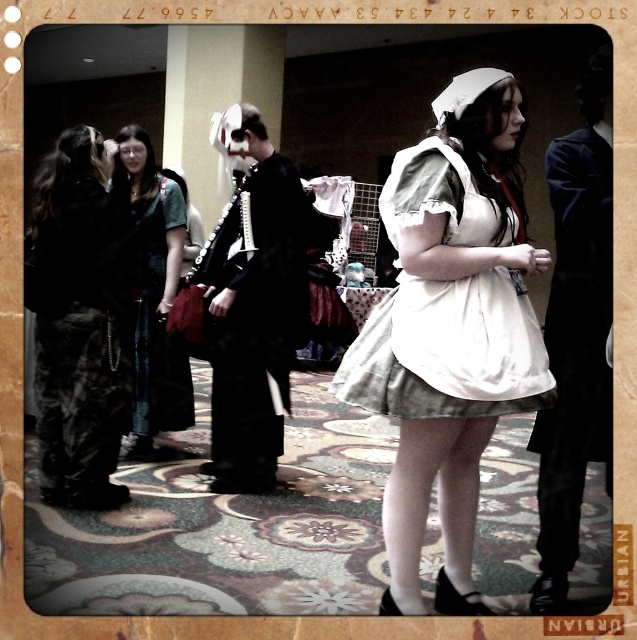
Does point (76, 269) lie in front of point (289, 364)?

Yes, it is in front of point (289, 364).

Can you confirm if camouflage pants at left is positioned to the left of black satin suit at center?

Correct, you'll find camouflage pants at left to the left of black satin suit at center.

You are a GUI agent. You are given a task and a screenshot of the screen. Output one action in this format:
    pyautogui.click(x=<x>, y=<y>)
    Task: Click on the camouflage pants at left
    Image resolution: width=637 pixels, height=640 pixels.
    Given the screenshot: What is the action you would take?
    pyautogui.click(x=80, y=321)

Image resolution: width=637 pixels, height=640 pixels. In order to click on camouflage pants at left in this screenshot , I will do `click(80, 321)`.

Locate an element on the screen. This screenshot has height=640, width=637. white cotton dress at center is located at coordinates (448, 349).

Between white cotton dress at center and black velvet coat at right, which one appears on the left side from the viewer's perspective?

Positioned to the left is white cotton dress at center.

Does point (431, 157) lie in front of point (566, 216)?

Yes, point (431, 157) is in front of point (566, 216).

The height and width of the screenshot is (640, 637). In order to click on white cotton dress at center in this screenshot , I will do `click(448, 349)`.

Is white cotton dress at center below denim skirt at left?

Actually, white cotton dress at center is above denim skirt at left.

Looking at this image, between white cotton dress at center and denim skirt at left, which one has less height?

With less height is white cotton dress at center.

Find the location of a particular element. The height and width of the screenshot is (640, 637). white cotton dress at center is located at coordinates (448, 349).